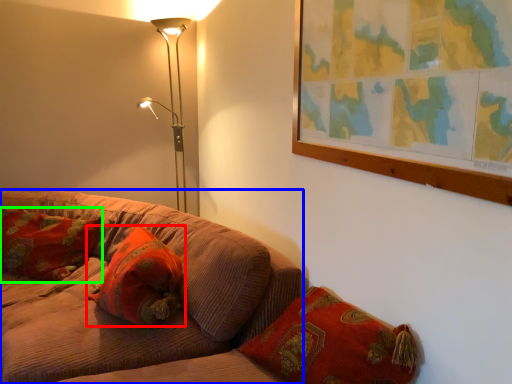
Question: Based on their relative distances, which object is farther from pillow (highlighted by a red box)? Choose from studio couch (highlighted by a blue box) and pillow (highlighted by a green box).

Choices:
 (A) studio couch
 (B) pillow

Answer: (B)